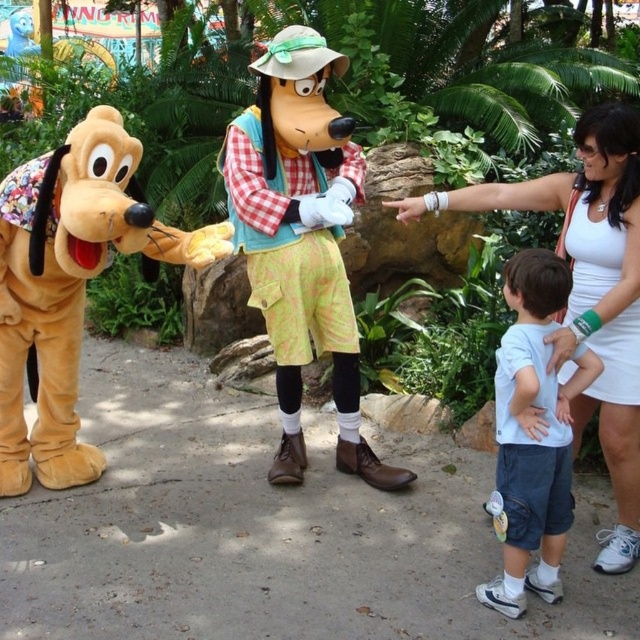
You are a costume designer inspecting the costumes of two characters in a theme park scene. You notice the white fabric at right and the white matte tank top at right. Which of these two items has a greater width?

The white fabric at right has a greater width than the white matte tank top at right.

You are a costume designer observing the two characters in the theme park scene. You need to determine which costume element is visible on top. Which one is the checkered fabric shirt at center in relation to the white matte tank top at right?

The checkered fabric shirt at center is positioned over the white matte tank top at right, making it the visible top layer.